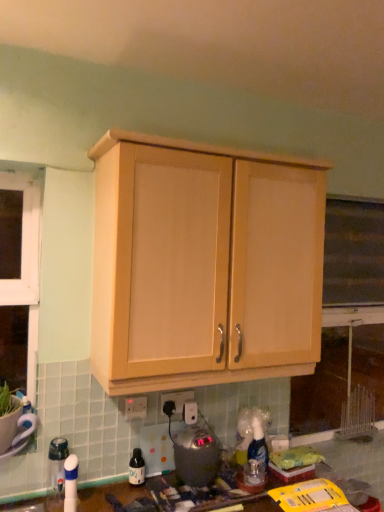
Question: From a real-world perspective, is translucent plastic bottle at lower center above or below satin silver appliance at lower center?

Choices:
 (A) above
 (B) below

Answer: (B)

Question: Does point (140, 459) appear closer or farther from the camera than point (196, 473)?

Choices:
 (A) farther
 (B) closer

Answer: (A)

Question: Based on their relative distances, which object is farther from the light wood cabinet at upper center?

Choices:
 (A) white plastic electric outlet at center, placed as the 2th electric outlet when sorted from left to right
 (B) satin silver appliance at lower center
 (C) translucent plastic bottle at lower center
 (D) white plastic electric outlet at lower center, arranged as the first electric outlet when viewed from the left

Answer: (C)

Question: Considering the real-world distances, which object is closest to the light wood cabinet at upper center?

Choices:
 (A) white plastic electric outlet at center, the 1th electric outlet from the back
 (B) satin silver appliance at lower center
 (C) white plastic electric outlet at lower center, the second electric outlet viewed from the right
 (D) translucent plastic bottle at lower center

Answer: (B)